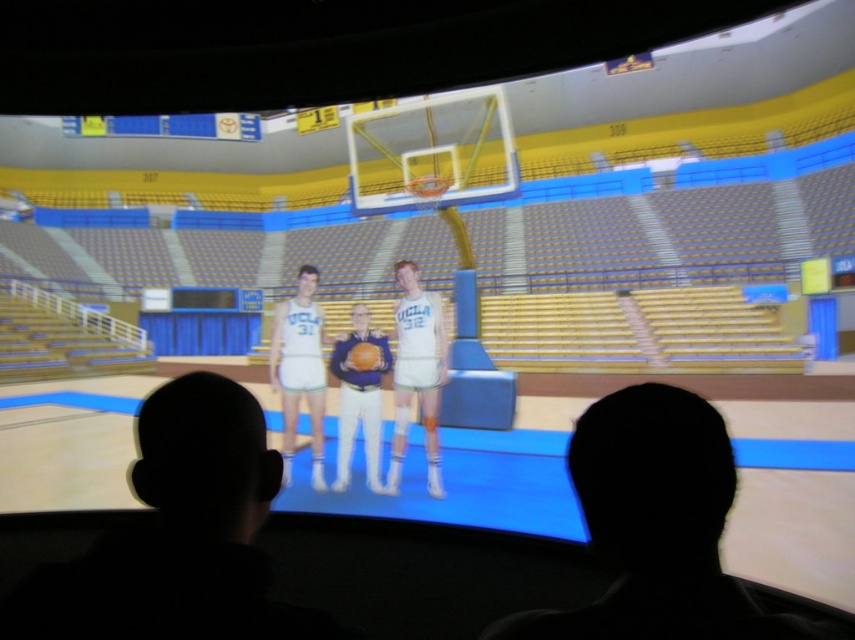
Based on the scene, is the metallic gold basketball hoop at upper center positioned to the left or right of the white matte basketball uniform at center?

The metallic gold basketball hoop at upper center is positioned to the left of the white matte basketball uniform at center.

You are a photographer standing at the bottom of the basketball court scene displayed on the screen. You want to capture a photo where both the white matte basketball uniform at center and the orange matte basketball at center are clearly visible. Considering their sizes, which object should you focus on first to ensure both are in frame?

The white matte basketball uniform at center is taller than the orange matte basketball at center. Therefore, focusing on the taller uniform first will ensure the basketball is also within the frame since it is smaller and positioned at the same central area.

You are a photographer standing at the bottom of the basketball court scene displayed on the screen. You want to take a photo that includes both the matte blue uniform at center and the orange matte basketball at center. Based on their positions, will the basketball appear above or below the uniform in the photo?

The matte blue uniform at center is positioned under the orange matte basketball at center, so the basketball will appear above the uniform in the photo.